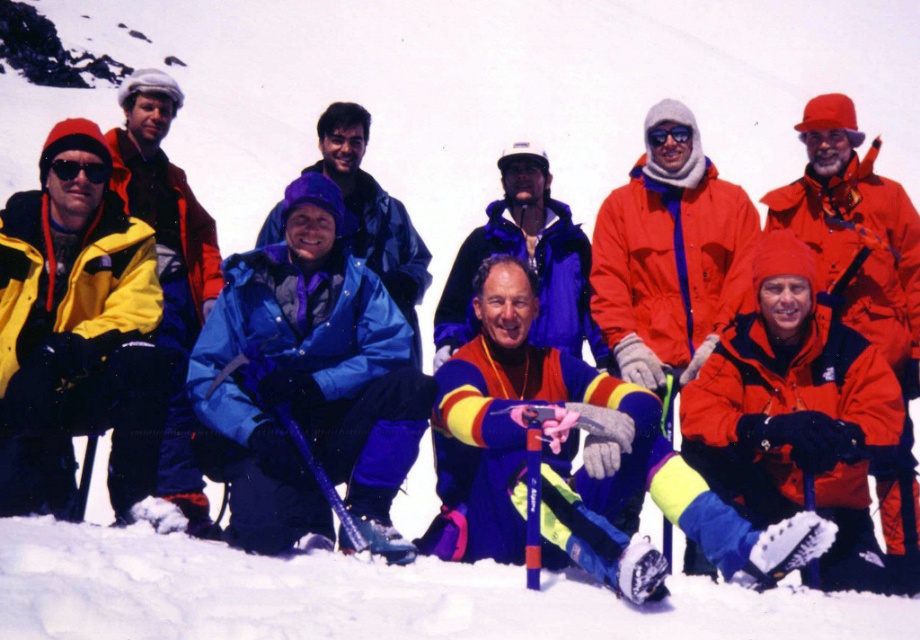
You are planning to take a group photo in a snowy area and want to ensure everyone fits in the frame. You notice two people wearing jackets labeled as matte blue jacket at center and blue matte jacket at center. Which jacket is wider?

The matte blue jacket at center is wider than the blue matte jacket at center according to the description.

You are a photographer trying to capture a closeup of the matte yellow jacket at left. What are the coordinates where you should focus your camera?

The coordinates to focus on are (77, 330).